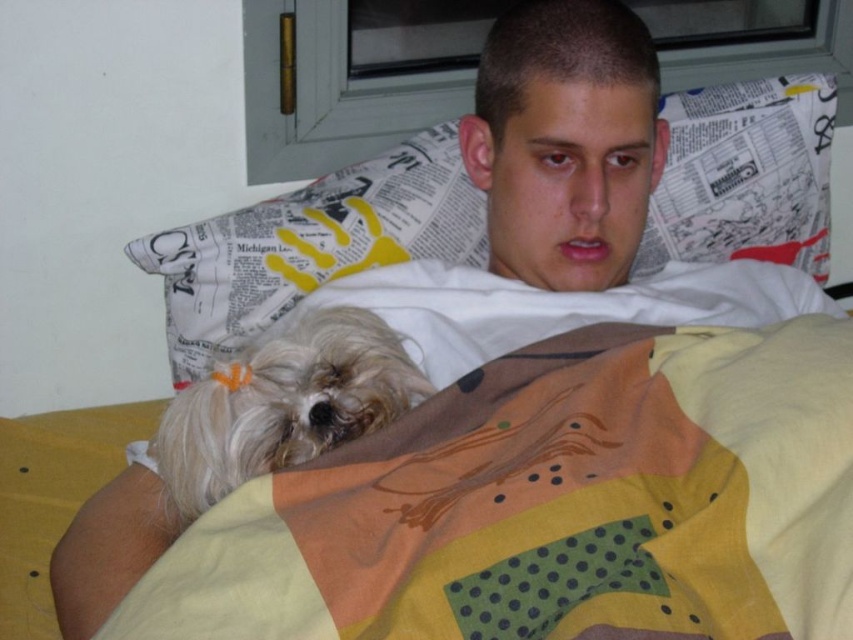
Is yellow cotton blanket at lower left positioned at the back of white fluffy dog at lower left?

No, yellow cotton blanket at lower left is closer to the viewer.

Between point (428, 552) and point (254, 349), which one is positioned behind?

Positioned behind is point (254, 349).

Is point (495, 452) behind point (186, 397)?

No, it is not.

Image resolution: width=853 pixels, height=640 pixels. In order to click on yellow cotton blanket at lower left in this screenshot , I will do `click(552, 506)`.

Can you confirm if white newspaper at upper center is taller than white fluffy dog at lower left?

Yes, white newspaper at upper center is taller than white fluffy dog at lower left.

Does white newspaper at upper center come behind white fluffy dog at lower left?

That is True.

Identify the location of white newspaper at upper center. (310, 243).

Identify the location of white newspaper at upper center. (310, 243).

Who is higher up, yellow cotton blanket at lower left or white newspaper at upper center?

Positioned higher is white newspaper at upper center.

Between yellow cotton blanket at lower left and white newspaper at upper center, which one appears on the right side from the viewer's perspective?

yellow cotton blanket at lower left is more to the right.

Where is `yellow cotton blanket at lower left`? The image size is (853, 640). yellow cotton blanket at lower left is located at coordinates (552, 506).

The image size is (853, 640). Find the location of `yellow cotton blanket at lower left`. yellow cotton blanket at lower left is located at coordinates (552, 506).